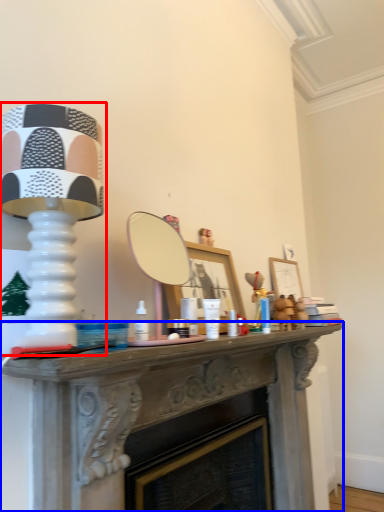
Question: Which object is closer to the camera taking this photo, table lamp (highlighted by a red box) or table (highlighted by a blue box)?

Choices:
 (A) table lamp
 (B) table

Answer: (A)